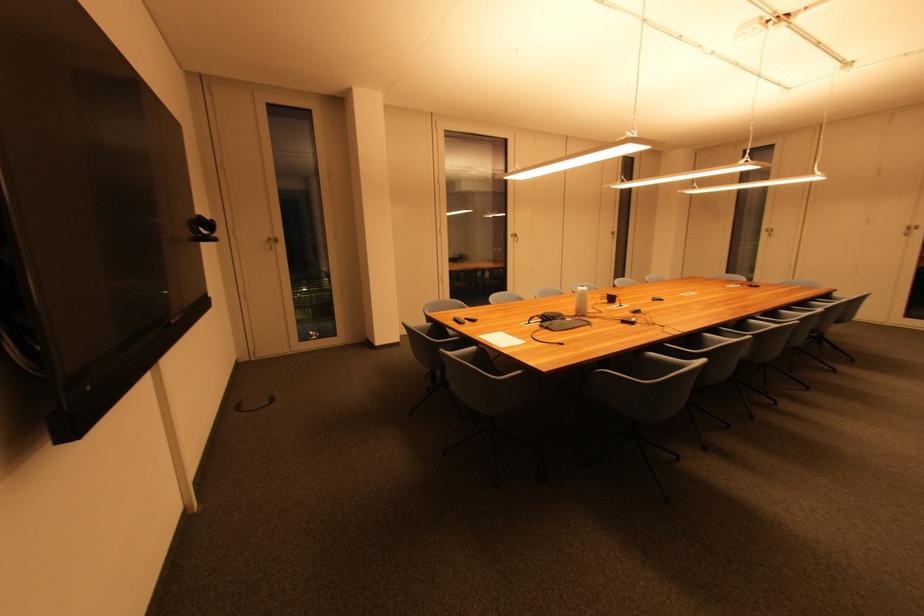
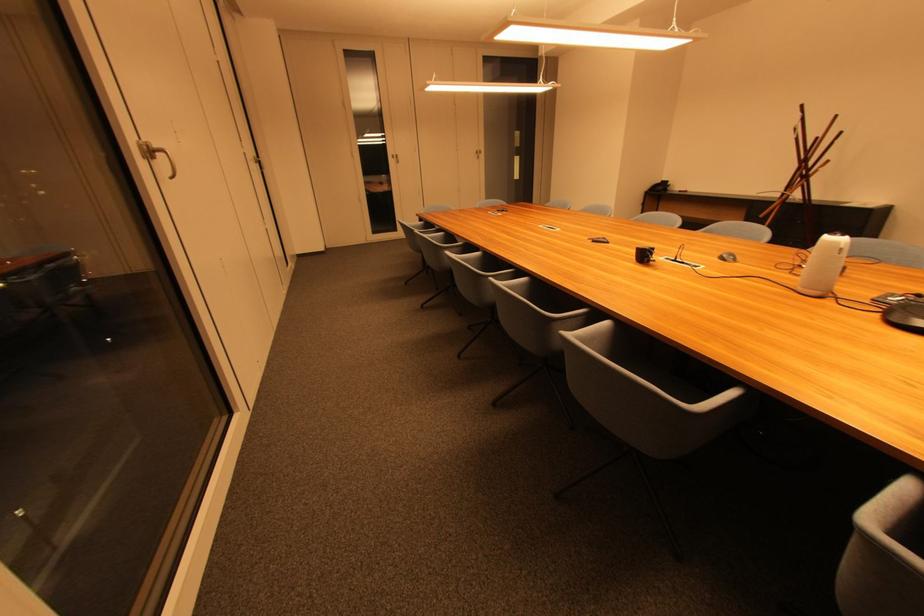
The point at [616,301] is marked in the first image. Where is the corresponding point in the second image?

(649, 257)